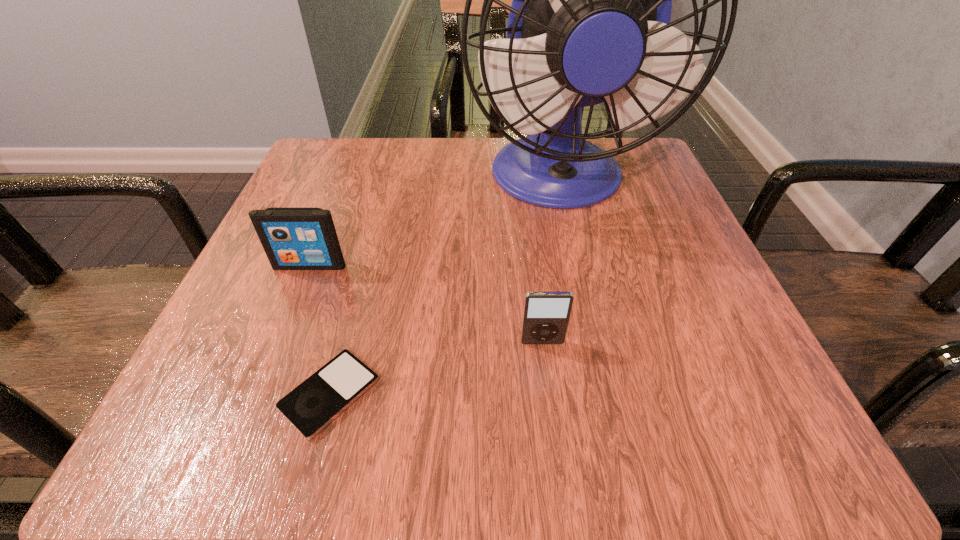
Identify the location of vacant space in between the nearest iPod and the farthest iPod. The image size is (960, 540). (320, 330).

The height and width of the screenshot is (540, 960). I want to click on empty space that is in between the nearest iPod and the third nearest object, so click(x=320, y=330).

Locate an element on the screen. This screenshot has height=540, width=960. object that is the third closest one to the farthest iPod is located at coordinates (546, 315).

Find the location of a particular element. This screenshot has height=540, width=960. object that is the second nearest to the farthest iPod is located at coordinates click(589, 23).

Identify which iPod is the second closest to the rightmost iPod. Please provide its 2D coordinates. Your answer should be formatted as a tuple, i.e. [(x, y)], where the tuple contains the x and y coordinates of a point satisfying the conditions above.

[(293, 238)]

Identify the location of the second closest iPod to the tallest object. (546, 315).

Locate an element on the screen. The width and height of the screenshot is (960, 540). vacant area that satisfies the following two spatial constraints: 1. on the front screen of the second farthest object; 2. on the left side of the shortest iPod is located at coordinates (259, 394).